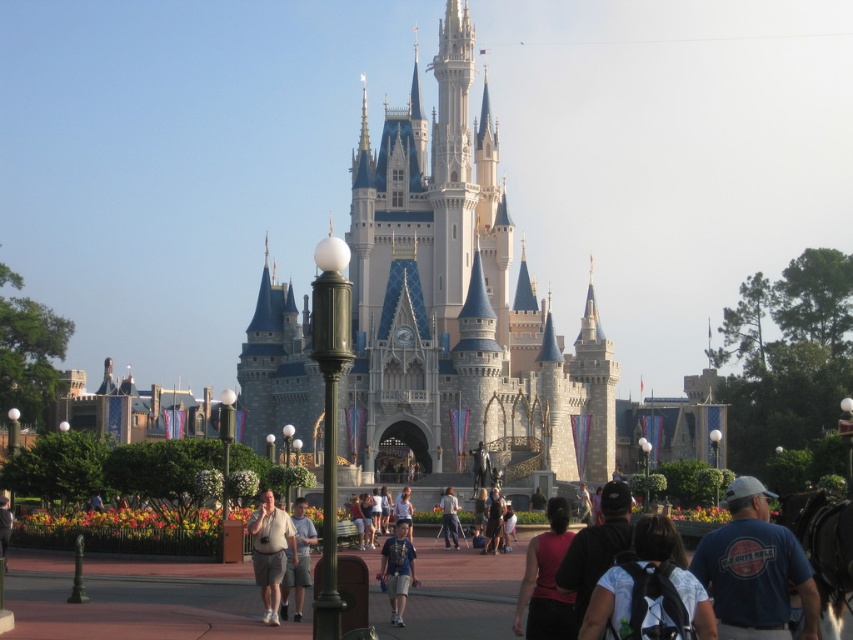
You are standing on the walkway and want to take a photo of the castle. However, there are two people in front of you wearing blue denim shorts at center and light brown fabric shorts at center. Which person is blocking your view more?

The blue denim shorts at center is in front of light brown fabric shorts at center, so the person wearing blue denim shorts at center is blocking your view more since they are closer to you.

Looking at this image, you are standing at the entrance of the theme park and see the blue denim shorts at center. If you walk straight ahead, will you reach the castle first or the walkway?

The blue denim shorts at center is located at point [397,570], which is closer to the castle than the walkway. Therefore, you will reach the castle first.